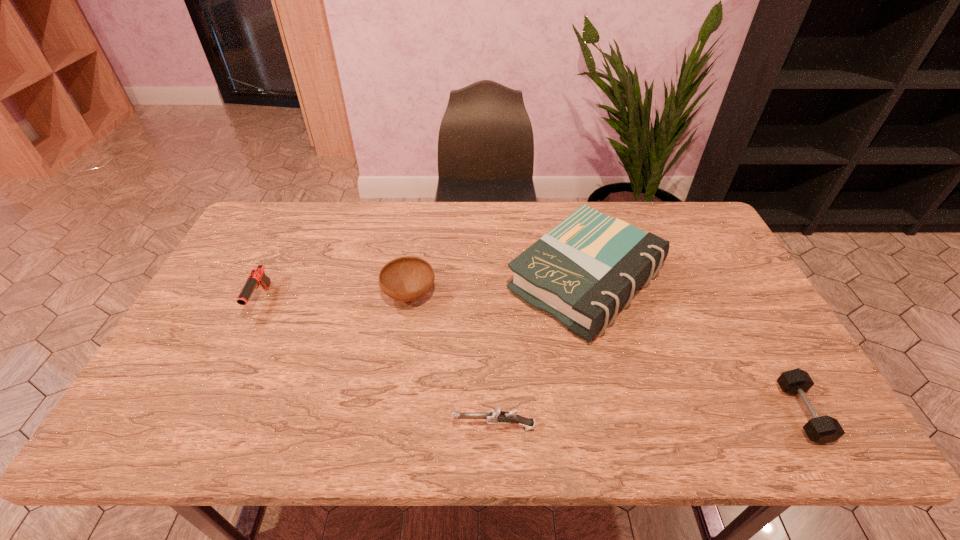
In order to click on free space that is in between the shorter gun and the shortest object in this screenshot , I will do `click(648, 420)`.

You are a GUI agent. You are given a task and a screenshot of the screen. Output one action in this format:
    pyautogui.click(x=<x>, y=<y>)
    Task: Click on the vacant region between the bowl and the rightmost object
    
    Given the screenshot: What is the action you would take?
    pyautogui.click(x=606, y=354)

At what (x,y) coordinates should I click in order to perform the action: click on free space between the leftmost object and the shortest object. Please return your answer as a coordinate pair (x, y). Looking at the image, I should click on (531, 356).

This screenshot has width=960, height=540. I want to click on vacant area that lies between the left gun and the rightmost object, so click(531, 356).

This screenshot has width=960, height=540. Find the location of `object that can be found as the second closest to the shortest object`. object that can be found as the second closest to the shortest object is located at coordinates (496, 416).

The image size is (960, 540). Identify the location of the closest object to the leftmost object. (409, 278).

Where is `vacant area in the image that satisfies the following two spatial constraints: 1. at the aiming end of the dumbbell; 2. on the right side of the taller gun`? This screenshot has height=540, width=960. vacant area in the image that satisfies the following two spatial constraints: 1. at the aiming end of the dumbbell; 2. on the right side of the taller gun is located at coordinates (206, 413).